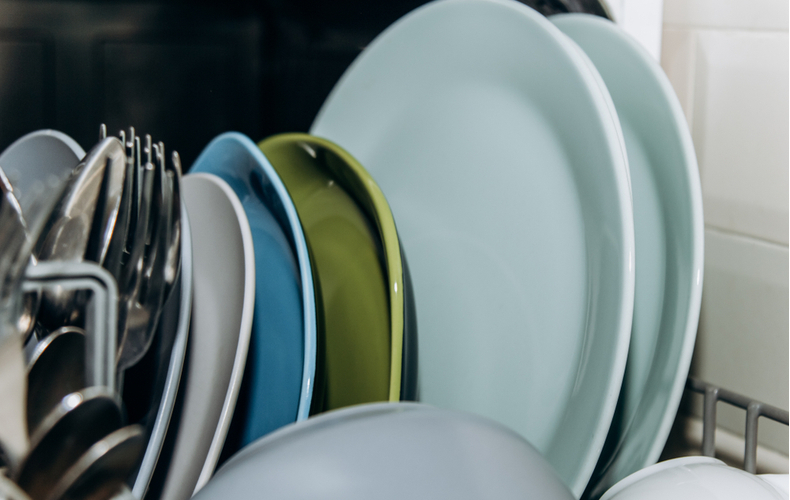
You are a GUI agent. You are given a task and a screenshot of the screen. Output one action in this format:
    pyautogui.click(x=<x>, y=<y>)
    Task: Click on the prongs of fork
    The width and height of the screenshot is (790, 500).
    Given the screenshot: What is the action you would take?
    pyautogui.click(x=102, y=127), pyautogui.click(x=121, y=136), pyautogui.click(x=132, y=131), pyautogui.click(x=130, y=171), pyautogui.click(x=148, y=146), pyautogui.click(x=158, y=171), pyautogui.click(x=175, y=172)